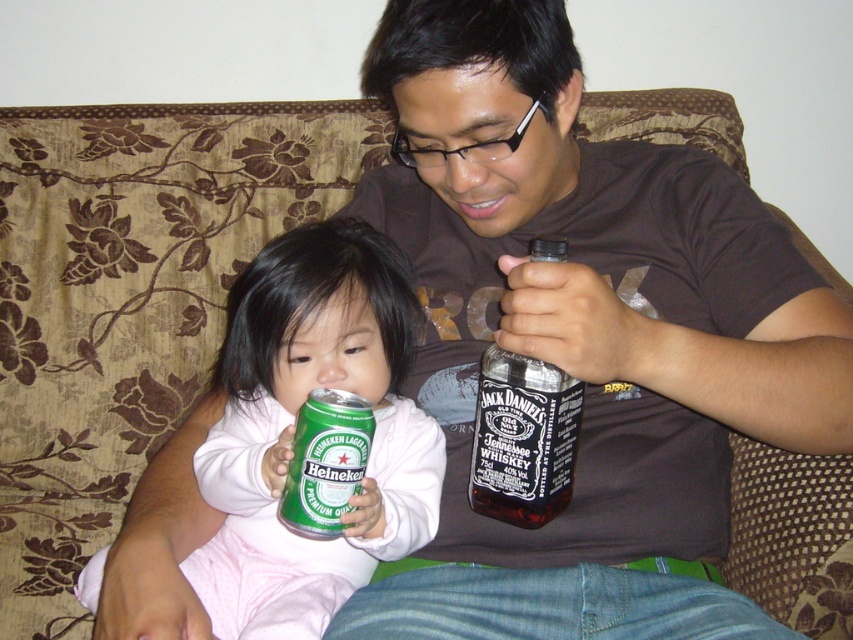
Question: Among these points, which one is farthest from the camera?

Choices:
 (A) (479, 397)
 (B) (323, 451)
 (C) (412, 406)

Answer: (C)

Question: Does green matte heineken can at left have a smaller size compared to clear glass bottle of jack daniel's tennessee whiskey at center?

Choices:
 (A) yes
 (B) no

Answer: (B)

Question: Is clear glass bottle of jack daniel's tennessee whiskey at center to the right of green metallic can at center from the viewer's perspective?

Choices:
 (A) yes
 (B) no

Answer: (A)

Question: Based on their relative distances, which object is nearer to the clear glass bottle of jack daniel's tennessee whiskey at center?

Choices:
 (A) green metallic can at center
 (B) green matte heineken can at left

Answer: (A)

Question: Can you confirm if green matte heineken can at left is thinner than clear glass bottle of jack daniel's tennessee whiskey at center?

Choices:
 (A) yes
 (B) no

Answer: (B)

Question: Among these objects, which one is nearest to the camera?

Choices:
 (A) green matte heineken can at left
 (B) clear glass bottle of jack daniel's tennessee whiskey at center

Answer: (B)